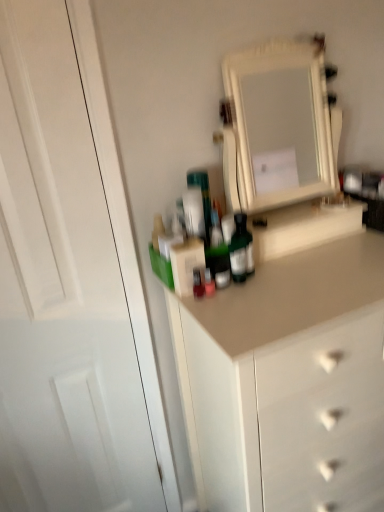
Question: Considering the positions of white glossy medicine cabinet at upper center and white glossy door at left in the image, is white glossy medicine cabinet at upper center taller or shorter than white glossy door at left?

Choices:
 (A) tall
 (B) short

Answer: (B)

Question: From a real-world perspective, is white glossy medicine cabinet at upper center positioned above or below white glossy door at left?

Choices:
 (A) below
 (B) above

Answer: (B)

Question: Is white glossy medicine cabinet at upper center wider or thinner than white glossy door at left?

Choices:
 (A) wide
 (B) thin

Answer: (A)

Question: Is white glossy door at left to the left or to the right of white glossy medicine cabinet at upper center in the image?

Choices:
 (A) left
 (B) right

Answer: (A)

Question: In terms of height, does white glossy door at left look taller or shorter compared to white glossy medicine cabinet at upper center?

Choices:
 (A) short
 (B) tall

Answer: (B)

Question: Choose the correct answer: Is white glossy door at left inside white glossy medicine cabinet at upper center or outside it?

Choices:
 (A) inside
 (B) outside

Answer: (B)

Question: Looking at their shapes, would you say white glossy door at left is wider or thinner than white glossy medicine cabinet at upper center?

Choices:
 (A) wide
 (B) thin

Answer: (B)